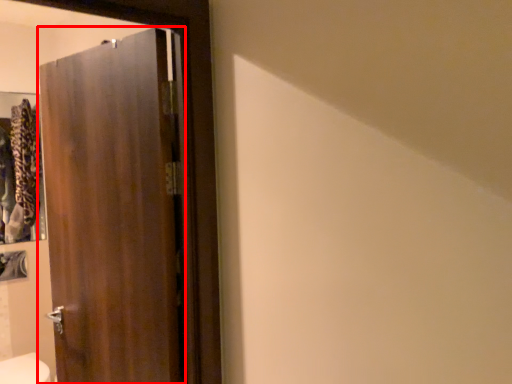
Question: Observing the image, what is the correct spatial positioning of door (annotated by the red box) in reference to bidet?

Choices:
 (A) left
 (B) right

Answer: (B)